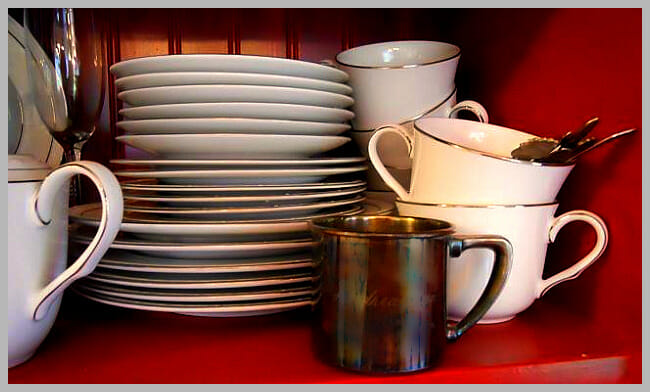
At what (x,y) coordinates should I click in order to perform the action: click on coffee cups. Please return your answer as a coordinate pair (x, y). The width and height of the screenshot is (650, 392). Looking at the image, I should click on (409, 86), (442, 108), (389, 194), (431, 208), (470, 158), (32, 242), (383, 287).